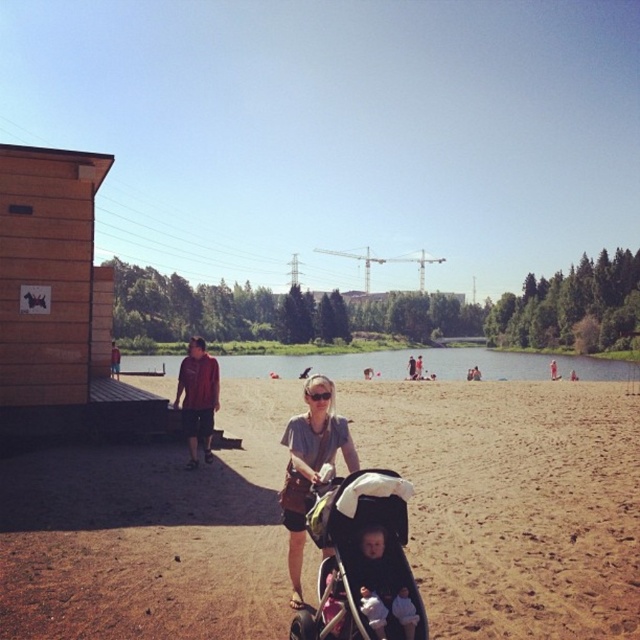
You are a parent at the beach and want to ensure your baby stays cool. You have a light gray fabric baby at center and brown sand at center. Which object is positioned to the right, potentially closer to the shaded area under the trees?

The brown sand at center is to the right of light gray fabric baby at center, so it is positioned closer to the shaded area under the trees.

You are standing at the wooden structure on the left side of the beach and want to walk towards the woman pushing the stroller. Which point, point (209, 460) or point (369, 621), is closer to your starting position?

Point (209, 460) is closer to your starting position because it is further to the viewer than point (369, 621).